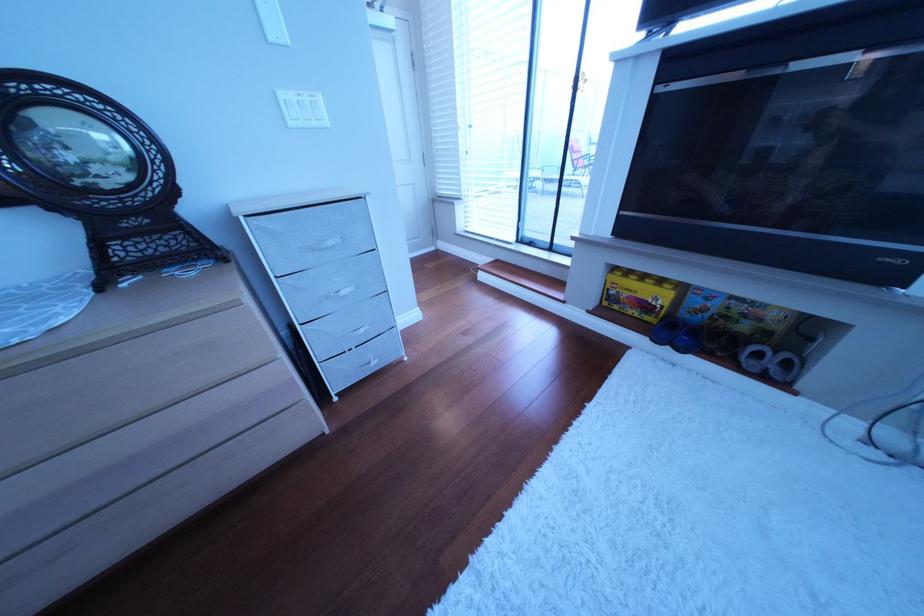
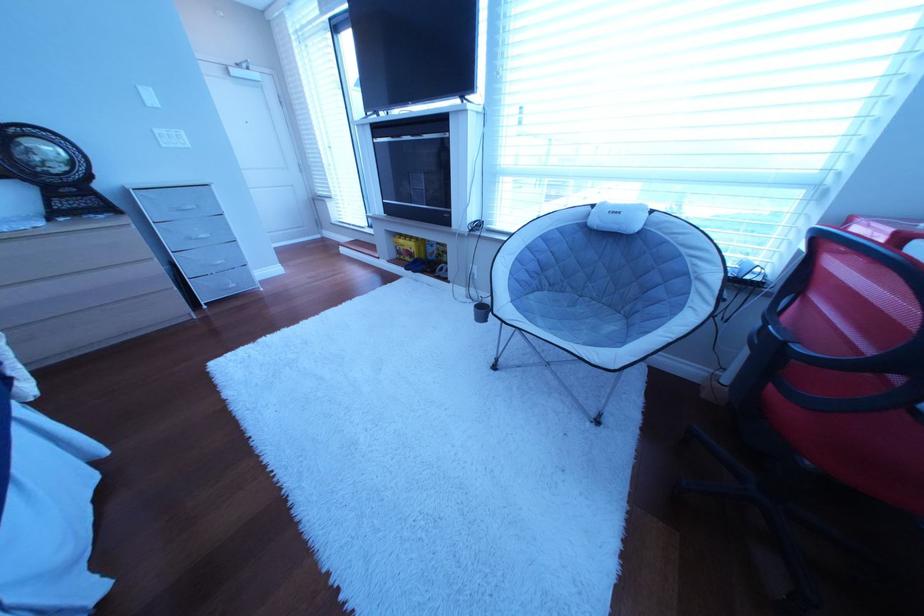
Locate, in the second image, the point that corresponds to (330,252) in the first image.

(193, 213)